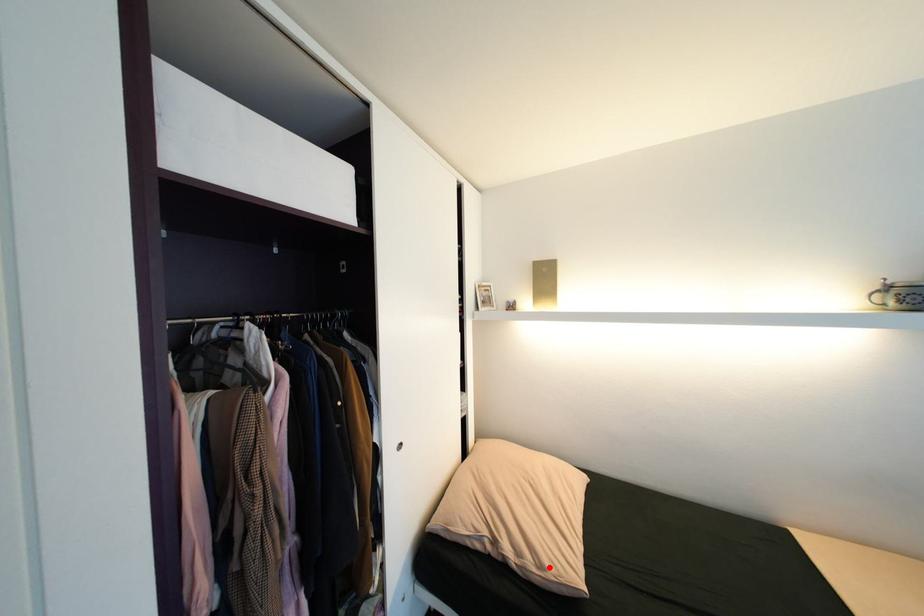
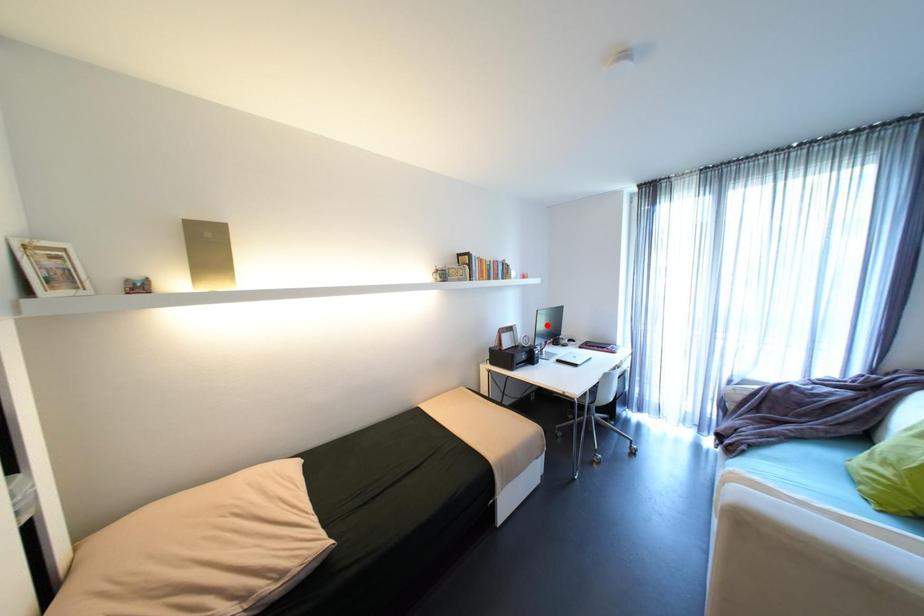
I am providing you with two images of the same scene from different viewpoints. A red point is marked on the first image and another point is marked on the second image. Do the highlighted points in image1 and image2 indicate the same real-world spot?

No